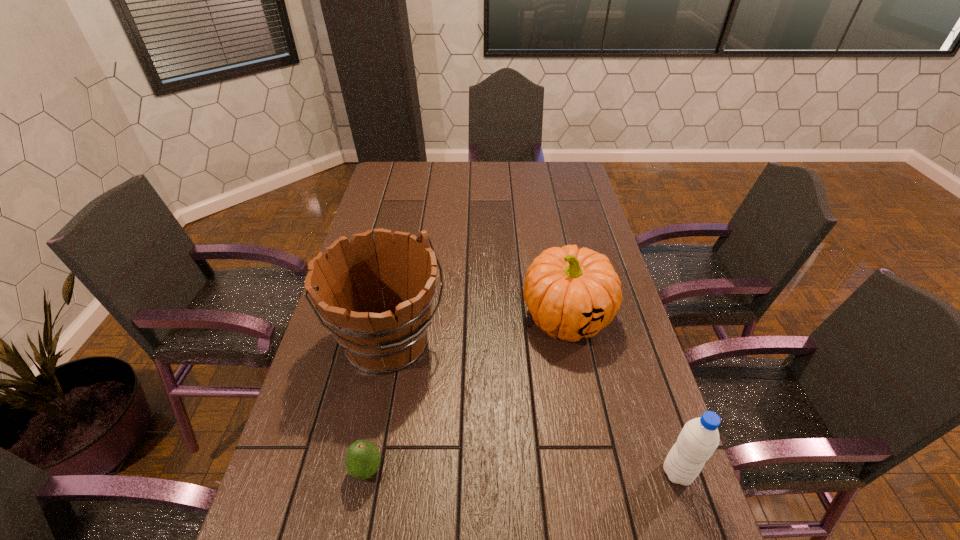
The height and width of the screenshot is (540, 960). Identify the location of free space on the desktop that is between the avocado and the rightmost object and is positioned with the handle on the tallest object. (x=500, y=471).

What are the coordinates of `vacant space on the desktop that is between the shortest object and the water bottle and is positioned on the surface of the pumpkin` in the screenshot? It's located at (481, 471).